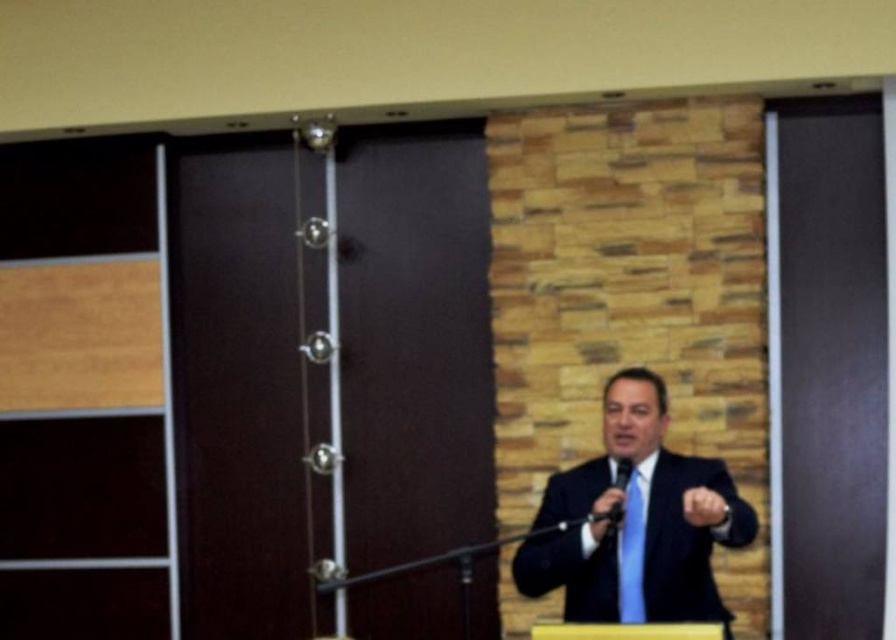
You are an event organizer who needs to ensure the speaker is visible to the audience. Considering the matte black suit at center and the blue silk tie at center, which one is more likely to stand out visually against the dark background of the wooden panels?

The blue silk tie at center is more likely to stand out visually against the dark background of the wooden panels because its color contrasts more with the dark brown wooden panels compared to the matte black suit at center.

You are an event organizer setting up a stage. The podium is at the center, and you need to place a spotlight at point coordinates (636, 522). What object will the spotlight illuminate?

The spotlight at coordinates (636, 522) will illuminate the matte black suit at center.